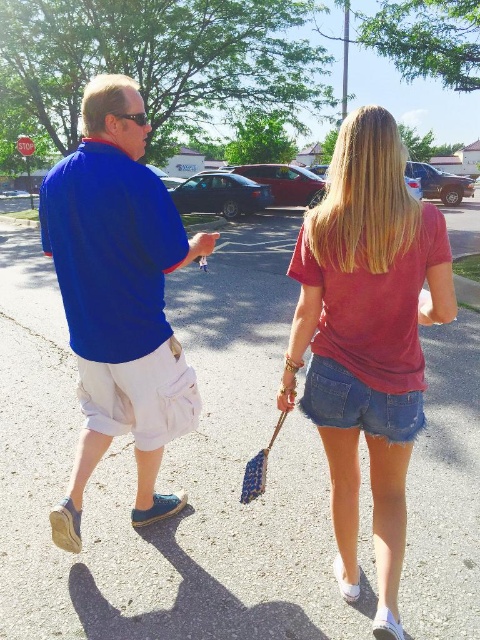
Who is positioned more to the left, denim shorts at center or blue cotton shirt at left?

blue cotton shirt at left is more to the left.

Who is positioned more to the right, denim shorts at center or blue cotton shirt at left?

Positioned to the right is denim shorts at center.

Image resolution: width=480 pixels, height=640 pixels. Find the location of `denim shorts at center`. denim shorts at center is located at coordinates (367, 339).